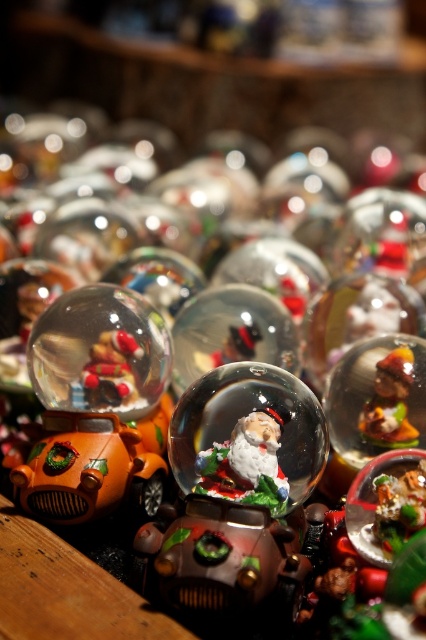
Looking at the festive display, there are two main items in the foreground of the snow globes arrangement on the wooden surface. One is the translucent glass snow globe at center and the other is the shiny silver santa at center. Which of these two items is positioned more to the right?

The translucent glass snow globe at center is positioned to the right of the shiny silver santa at center, so it is more to the right.

Based on the photo, you are organizing a display of holiday items and need to place a decorative star between the clear glass snow globe at center and the shiny silver santa at center. Based on their positions, where should you place the star to ensure it is between them?

The clear glass snow globe at center is to the left of the shiny silver santa at center, so you should place the decorative star between them to the right of the clear glass snow globe at center and to the left of the shiny silver santa at center.